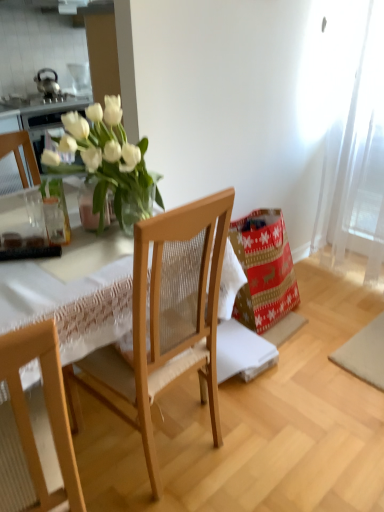
Question: Is clear glass vase at left facing away from wooden chair at center?

Choices:
 (A) yes
 (B) no

Answer: (A)

Question: Is clear glass vase at left positioned before wooden chair at center?

Choices:
 (A) no
 (B) yes

Answer: (A)

Question: From the image's perspective, is clear glass vase at left located above wooden chair at center?

Choices:
 (A) no
 (B) yes

Answer: (B)

Question: Is clear glass vase at left far from wooden chair at center?

Choices:
 (A) yes
 (B) no

Answer: (B)

Question: Does clear glass vase at left have a greater height compared to wooden chair at center?

Choices:
 (A) yes
 (B) no

Answer: (B)

Question: From their relative heights in the image, would you say clear glass vase at left is taller or shorter than wooden chair at center?

Choices:
 (A) tall
 (B) short

Answer: (B)

Question: Is clear glass vase at left situated inside wooden chair at center or outside?

Choices:
 (A) outside
 (B) inside

Answer: (A)

Question: From a real-world perspective, is clear glass vase at left positioned above or below wooden chair at center?

Choices:
 (A) above
 (B) below

Answer: (A)

Question: Looking at their shapes, would you say clear glass vase at left is wider or thinner than wooden chair at center?

Choices:
 (A) wide
 (B) thin

Answer: (B)

Question: From a real-world perspective, is clear glass vase at center positioned above or below wooden chair at center?

Choices:
 (A) above
 (B) below

Answer: (A)

Question: From the image's perspective, is clear glass vase at center above or below wooden chair at center?

Choices:
 (A) above
 (B) below

Answer: (A)

Question: Considering the positions of clear glass vase at center and wooden chair at center in the image, is clear glass vase at center bigger or smaller than wooden chair at center?

Choices:
 (A) big
 (B) small

Answer: (B)

Question: In the image, is clear glass vase at center positioned in front of or behind wooden chair at center?

Choices:
 (A) behind
 (B) front

Answer: (A)

Question: From the image's perspective, is clear glass vase at center located above or below red and gold paper bag at lower right?

Choices:
 (A) above
 (B) below

Answer: (A)

Question: Is clear glass vase at center bigger or smaller than red and gold paper bag at lower right?

Choices:
 (A) big
 (B) small

Answer: (B)